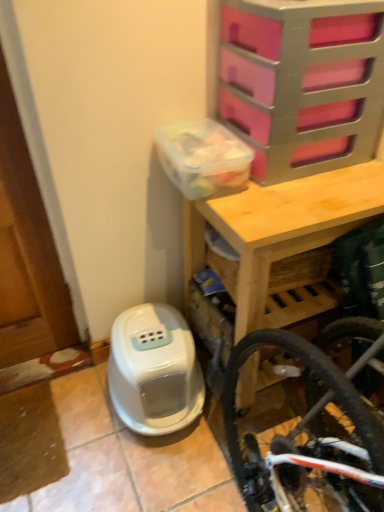
This screenshot has width=384, height=512. Describe the element at coordinates (154, 370) in the screenshot. I see `white plastic water heater at lower left` at that location.

I want to click on wooden table at upper center, so click(280, 226).

I want to click on pink plastic drawer at upper right, so click(302, 83).

Is wooden table at upper center shorter than pink plastic drawer at upper right?

In fact, wooden table at upper center may be taller than pink plastic drawer at upper right.

Is wooden table at upper center aimed at pink plastic drawer at upper right?

No, wooden table at upper center does not turn towards pink plastic drawer at upper right.

Which of these two, wooden table at upper center or pink plastic drawer at upper right, is bigger?

wooden table at upper center is bigger.

From a real-world perspective, between wooden table at upper center and pink plastic drawer at upper right, who is vertically lower?

From a 3D spatial view, wooden table at upper center is below.

Is point (237, 84) less distant than point (243, 221)?

No, it is not.

Considering the relative positions of pink plastic drawer at upper right and wooden table at upper center in the image provided, is pink plastic drawer at upper right behind wooden table at upper center?

No, pink plastic drawer at upper right is in front of wooden table at upper center.

This screenshot has width=384, height=512. Identify the location of table below the pink plastic drawer at upper right (from a real-world perspective). (280, 226).

Is pink plastic drawer at upper right smaller than wooden table at upper center?

Indeed, pink plastic drawer at upper right has a smaller size compared to wooden table at upper center.

From a real-world perspective, does white plastic water heater at lower left stand above wooden table at upper center?

Actually, white plastic water heater at lower left is physically below wooden table at upper center in the real world.

Considering the positions of objects white plastic water heater at lower left and wooden table at upper center in the image provided, who is behind, white plastic water heater at lower left or wooden table at upper center?

white plastic water heater at lower left is behind.

Considering the points (187, 340) and (339, 173), which point is behind, point (187, 340) or point (339, 173)?

The point (187, 340) is more distant.

Could wooden table at upper center be considered to be inside white plastic water heater at lower left?

Definitely not — wooden table at upper center is not inside white plastic water heater at lower left.

From a real-world perspective, is white plastic water heater at lower left beneath pink plastic drawer at upper right?

Indeed, from a real-world perspective, white plastic water heater at lower left is positioned beneath pink plastic drawer at upper right.

Does white plastic water heater at lower left appear on the left side of pink plastic drawer at upper right?

Yes, white plastic water heater at lower left is to the left of pink plastic drawer at upper right.

Is white plastic water heater at lower left surrounding pink plastic drawer at upper right?

No.

Does pink plastic drawer at upper right have a lesser height compared to white plastic water heater at lower left?

No, pink plastic drawer at upper right is not shorter than white plastic water heater at lower left.

Looking at this image, is pink plastic drawer at upper right facing towards white plastic water heater at lower left?

No, pink plastic drawer at upper right is not turned towards white plastic water heater at lower left.

In the scene shown: Is pink plastic drawer at upper right outside of white plastic water heater at lower left?

Yes, pink plastic drawer at upper right is located beyond the bounds of white plastic water heater at lower left.

Locate an element on the screen. water heater below the pink plastic drawer at upper right (from the image's perspective) is located at coordinates (154, 370).

Does wooden table at upper center have a smaller size compared to white plastic water heater at lower left?

No.

Is point (379, 204) in front of point (189, 354)?

That is True.

The width and height of the screenshot is (384, 512). In order to click on table above the white plastic water heater at lower left (from a real-world perspective) in this screenshot , I will do `click(280, 226)`.

Is white plastic water heater at lower left inside wooden table at upper center?

No, wooden table at upper center does not contain white plastic water heater at lower left.

Identify the location of drawer in front of the wooden table at upper center. (302, 83).

This screenshot has width=384, height=512. Find the location of `table below the pink plastic drawer at upper right (from the image's perspective)`. table below the pink plastic drawer at upper right (from the image's perspective) is located at coordinates (280, 226).

Estimate the real-world distances between objects in this image. Which object is further from wooden table at upper center, white plastic water heater at lower left or pink plastic drawer at upper right?

white plastic water heater at lower left is further to wooden table at upper center.

When comparing their distances from wooden table at upper center, does pink plastic drawer at upper right or white plastic water heater at lower left seem closer?

pink plastic drawer at upper right is positioned closer to the anchor wooden table at upper center.

Estimate the real-world distances between objects in this image. Which object is closer to white plastic water heater at lower left, pink plastic drawer at upper right or wooden table at upper center?

wooden table at upper center lies closer to white plastic water heater at lower left than the other object.

Looking at this image, considering their positions, is white plastic water heater at lower left positioned closer to pink plastic drawer at upper right than wooden table at upper center?

The object closer to pink plastic drawer at upper right is wooden table at upper center.

Looking at the image, which one is located further to pink plastic drawer at upper right, wooden table at upper center or white plastic water heater at lower left?

Among the two, white plastic water heater at lower left is located further to pink plastic drawer at upper right.

Looking at this image, from the image, which object appears to be nearer to white plastic water heater at lower left, wooden table at upper center or pink plastic drawer at upper right?

wooden table at upper center is closer to white plastic water heater at lower left.

Locate an element on the screen. This screenshot has width=384, height=512. table that lies between pink plastic drawer at upper right and white plastic water heater at lower left from top to bottom is located at coordinates click(280, 226).